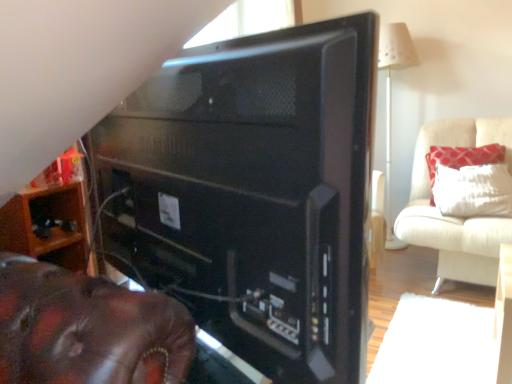
Describe the element at coordinates (253, 194) in the screenshot. The image size is (512, 384). I see `black matte desktop computer at center` at that location.

Describe the element at coordinates (463, 157) in the screenshot. I see `white textured pillow at upper right` at that location.

You are a GUI agent. You are given a task and a screenshot of the screen. Output one action in this format:
    pyautogui.click(x=<x>, y=<y>)
    Task: Click on the white fabric cushion at upper right, which is the first furniture in back-to-front order
    This screenshot has height=384, width=512.
    Given the screenshot: What is the action you would take?
    pyautogui.click(x=456, y=217)

At what (x,y) coordinates should I click in order to perform the action: click on wooden shelf at lower left, placed as the 1th furniture when sorted from left to right. Please return your answer as a coordinate pair (x, y). The image size is (512, 384). Looking at the image, I should click on (50, 216).

You are a GUI agent. You are given a task and a screenshot of the screen. Output one action in this format:
    pyautogui.click(x=<x>, y=<y>)
    Task: Click on the black matte desktop computer at center
    The width and height of the screenshot is (512, 384).
    Given the screenshot: What is the action you would take?
    pyautogui.click(x=253, y=194)

Considering the relative positions of white textured pillow at upper right and white fabric cushion at upper right, which is the first furniture in back-to-front order, in the image provided, is white textured pillow at upper right to the right of white fabric cushion at upper right, which is the first furniture in back-to-front order, from the viewer's perspective?

Yes, white textured pillow at upper right is to the right of white fabric cushion at upper right, which is the first furniture in back-to-front order.

Could you tell me if white textured pillow at upper right is turned towards white fabric cushion at upper right, placed as the 2th furniture when sorted from front to back?

Yes, white textured pillow at upper right is facing white fabric cushion at upper right, placed as the 2th furniture when sorted from front to back.

Are white textured pillow at upper right and white fabric cushion at upper right, which appears as the 2th furniture when viewed from the left, making contact?

No, white textured pillow at upper right is not touching white fabric cushion at upper right, which appears as the 2th furniture when viewed from the left.

Considering the relative sizes of black matte desktop computer at center and wooden shelf at lower left, placed as the 1th furniture when sorted from left to right, in the image provided, is black matte desktop computer at center thinner than wooden shelf at lower left, placed as the 1th furniture when sorted from left to right,?

Correct, the width of black matte desktop computer at center is less than that of wooden shelf at lower left, placed as the 1th furniture when sorted from left to right.

From a real-world perspective, who is located higher, black matte desktop computer at center or wooden shelf at lower left, placed as the 1th furniture when sorted from left to right?

black matte desktop computer at center, from a real-world perspective.

Is there a large distance between black matte desktop computer at center and wooden shelf at lower left, placed as the 1th furniture when sorted from left to right?

No, black matte desktop computer at center is not far from wooden shelf at lower left, placed as the 1th furniture when sorted from left to right.

From the image's perspective, which one is positioned higher, black matte desktop computer at center or wooden shelf at lower left, placed as the 1th furniture when sorted from left to right?

black matte desktop computer at center.

Is white textured pillow at upper right aimed at wooden shelf at lower left, which ranks as the second furniture in right-to-left order?

No, white textured pillow at upper right is not facing towards wooden shelf at lower left, which ranks as the second furniture in right-to-left order.

Which is behind, white textured pillow at upper right or wooden shelf at lower left, placed as the 1th furniture when sorted from left to right?

white textured pillow at upper right is behind.

How much distance is there between white textured pillow at upper right and wooden shelf at lower left, which ranks as the first furniture in front-to-back order?

→ white textured pillow at upper right is 6.86 feet away from wooden shelf at lower left, which ranks as the first furniture in front-to-back order.

Are white textured pillow at upper right and wooden shelf at lower left, which ranks as the first furniture in front-to-back order, far apart?

white textured pillow at upper right is far away from wooden shelf at lower left, which ranks as the first furniture in front-to-back order.

From a real-world perspective, is white fabric cushion at upper right, which appears as the 2th furniture when viewed from the left, physically located above or below black matte desktop computer at center?

white fabric cushion at upper right, which appears as the 2th furniture when viewed from the left, is below black matte desktop computer at center.

Are white fabric cushion at upper right, which is the first furniture in back-to-front order, and black matte desktop computer at center beside each other?

No, white fabric cushion at upper right, which is the first furniture in back-to-front order, is not beside black matte desktop computer at center.

Between white fabric cushion at upper right, which is the first furniture in back-to-front order, and black matte desktop computer at center, which one has smaller size?

black matte desktop computer at center.

From the image's perspective, is white fabric cushion at upper right, placed as the 2th furniture when sorted from front to back, positioned above or below black matte desktop computer at center?

white fabric cushion at upper right, placed as the 2th furniture when sorted from front to back, is above black matte desktop computer at center.

Is point (241, 337) closer to camera compared to point (435, 124)?

Yes, it is.

Is black matte desktop computer at center positioned in front of white fabric cushion at upper right, which appears as the 2th furniture when viewed from the left?

That is True.

Is black matte desktop computer at center placed right next to white fabric cushion at upper right, placed as the 2th furniture when sorted from front to back?

No, black matte desktop computer at center is not beside white fabric cushion at upper right, placed as the 2th furniture when sorted from front to back.

Visually, is black matte desktop computer at center positioned to the left or to the right of white fabric cushion at upper right, arranged as the 1th furniture when viewed from the right?

From the image, it's evident that black matte desktop computer at center is to the left of white fabric cushion at upper right, arranged as the 1th furniture when viewed from the right.

Considering the positions of points (46, 226) and (495, 244), is point (46, 226) closer to camera compared to point (495, 244)?

Yes, point (46, 226) is closer to viewer.

Consider the image. From the image's perspective, is wooden shelf at lower left, which ranks as the second furniture in right-to-left order, over white fabric cushion at upper right, placed as the 2th furniture when sorted from front to back?

Actually, wooden shelf at lower left, which ranks as the second furniture in right-to-left order, appears below white fabric cushion at upper right, placed as the 2th furniture when sorted from front to back, in the image.

Looking at their sizes, would you say wooden shelf at lower left, placed as the 1th furniture when sorted from left to right, is wider or thinner than white fabric cushion at upper right, arranged as the 1th furniture when viewed from the right?

Considering their sizes, wooden shelf at lower left, placed as the 1th furniture when sorted from left to right, looks slimmer than white fabric cushion at upper right, arranged as the 1th furniture when viewed from the right.

Would you say wooden shelf at lower left, which ranks as the first furniture in front-to-back order, is a long distance from white fabric cushion at upper right, which appears as the 2th furniture when viewed from the left?

Indeed, wooden shelf at lower left, which ranks as the first furniture in front-to-back order, is not near white fabric cushion at upper right, which appears as the 2th furniture when viewed from the left.

From the image's perspective, would you say wooden shelf at lower left, which ranks as the first furniture in front-to-back order, is shown under white textured pillow at upper right?

Correct, wooden shelf at lower left, which ranks as the first furniture in front-to-back order, appears lower than white textured pillow at upper right in the image.

Is wooden shelf at lower left, which ranks as the second furniture in right-to-left order, turned away from white textured pillow at upper right?

No.

Is wooden shelf at lower left, placed as the 1th furniture when sorted from left to right, smaller than white textured pillow at upper right?

Yes, wooden shelf at lower left, placed as the 1th furniture when sorted from left to right, is smaller than white textured pillow at upper right.

Does wooden shelf at lower left, placed as the 1th furniture when sorted from left to right, have a greater height compared to white textured pillow at upper right?

Incorrect, the height of wooden shelf at lower left, placed as the 1th furniture when sorted from left to right, is not larger of that of white textured pillow at upper right.

Where is `furniture that is under the white textured pillow at upper right (from a real-world perspective)`? furniture that is under the white textured pillow at upper right (from a real-world perspective) is located at coordinates (456, 217).

Locate an element on the screen. The image size is (512, 384). desktop computer that appears above the wooden shelf at lower left, placed as the 1th furniture when sorted from left to right (from the image's perspective) is located at coordinates (253, 194).

Based on their spatial positions, is black matte desktop computer at center or wooden shelf at lower left, placed as the 1th furniture when sorted from left to right, closer to white textured pillow at upper right?

black matte desktop computer at center is positioned closer to the anchor white textured pillow at upper right.

When comparing their distances from wooden shelf at lower left, placed as the 1th furniture when sorted from left to right, does white textured pillow at upper right or black matte desktop computer at center seem further?

white textured pillow at upper right lies further to wooden shelf at lower left, placed as the 1th furniture when sorted from left to right, than the other object.

From the image, which object appears to be farther from white fabric cushion at upper right, placed as the 2th furniture when sorted from front to back, black matte desktop computer at center or white textured pillow at upper right?

The object further to white fabric cushion at upper right, placed as the 2th furniture when sorted from front to back, is black matte desktop computer at center.

Estimate the real-world distances between objects in this image. Which object is further from white textured pillow at upper right, white fabric cushion at upper right, placed as the 2th furniture when sorted from front to back, or wooden shelf at lower left, which ranks as the first furniture in front-to-back order?

wooden shelf at lower left, which ranks as the first furniture in front-to-back order.

Which object lies nearer to the anchor point black matte desktop computer at center, white fabric cushion at upper right, placed as the 2th furniture when sorted from front to back, or white textured pillow at upper right?

white fabric cushion at upper right, placed as the 2th furniture when sorted from front to back, is positioned closer to the anchor black matte desktop computer at center.

Considering their positions, is black matte desktop computer at center positioned closer to white textured pillow at upper right than white fabric cushion at upper right, which appears as the 2th furniture when viewed from the left?

white fabric cushion at upper right, which appears as the 2th furniture when viewed from the left, lies closer to white textured pillow at upper right than the other object.

Estimate the real-world distances between objects in this image. Which object is closer to white fabric cushion at upper right, which is the first furniture in back-to-front order, white textured pillow at upper right or wooden shelf at lower left, which ranks as the first furniture in front-to-back order?

white textured pillow at upper right is closer to white fabric cushion at upper right, which is the first furniture in back-to-front order.

Estimate the real-world distances between objects in this image. Which object is closer to black matte desktop computer at center, wooden shelf at lower left, which ranks as the first furniture in front-to-back order, or white fabric cushion at upper right, which is the first furniture in back-to-front order?

Based on the image, wooden shelf at lower left, which ranks as the first furniture in front-to-back order, appears to be nearer to black matte desktop computer at center.

At what (x,y) coordinates should I click in order to perform the action: click on furniture between wooden shelf at lower left, which ranks as the second furniture in right-to-left order, and white textured pillow at upper right. Please return your answer as a coordinate pair (x, y). The width and height of the screenshot is (512, 384). Looking at the image, I should click on (456, 217).

Locate an element on the screen. desktop computer between wooden shelf at lower left, which ranks as the second furniture in right-to-left order, and white textured pillow at upper right, in the horizontal direction is located at coordinates (253, 194).

Where is `desktop computer between wooden shelf at lower left, which ranks as the second furniture in right-to-left order, and white fabric cushion at upper right, which appears as the 2th furniture when viewed from the left, in the horizontal direction`? Image resolution: width=512 pixels, height=384 pixels. desktop computer between wooden shelf at lower left, which ranks as the second furniture in right-to-left order, and white fabric cushion at upper right, which appears as the 2th furniture when viewed from the left, in the horizontal direction is located at coordinates (253, 194).